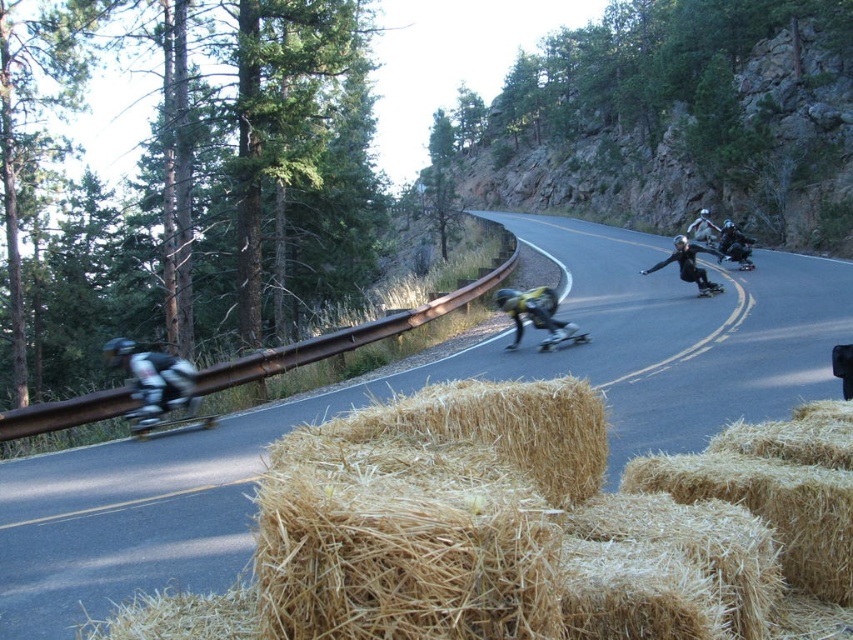
Which is more to the right, metallic silver skateboard at left or black matte skateboard at center?

black matte skateboard at center

Locate an element on the screen. This screenshot has height=640, width=853. metallic silver skateboard at left is located at coordinates (163, 422).

Is asphalt road at center further to the viewer compared to black matte skateboard at center?

No, asphalt road at center is closer to the viewer.

Where is `asphalt road at center`? The image size is (853, 640). asphalt road at center is located at coordinates (679, 337).

Does point (636, 253) come closer to viewer compared to point (573, 330)?

No, it is behind (573, 330).

Where is `asphalt road at center`? The height and width of the screenshot is (640, 853). asphalt road at center is located at coordinates (679, 337).

Between point (780, 376) and point (213, 419), which one is positioned behind?

Positioned behind is point (213, 419).

Which is behind, point (576, 273) or point (138, 422)?

The point (576, 273) is more distant.

What are the coordinates of `asphalt road at center` in the screenshot? It's located at (679, 337).